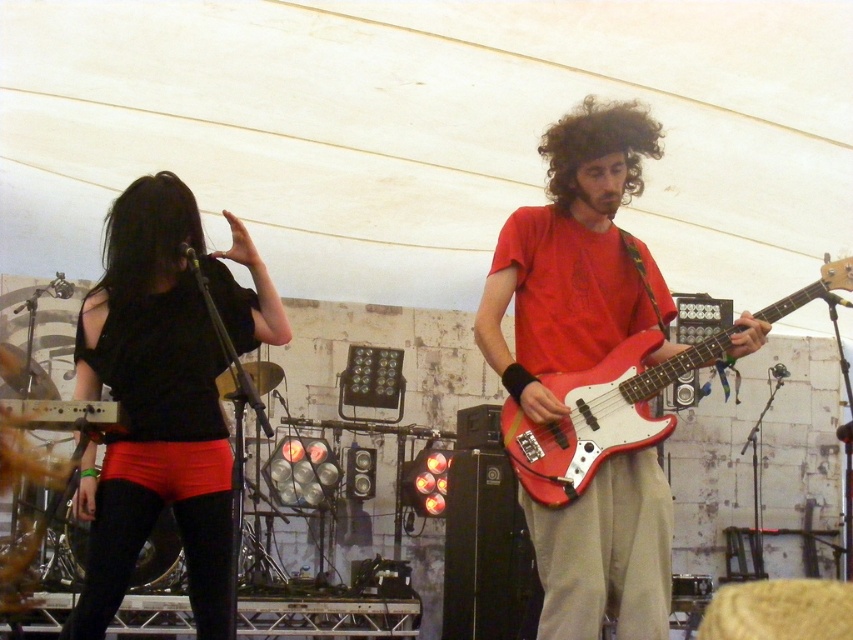
You are a photographer setting up for a live music shoot. You have a camera with a 30cm wide lens. You need to frame both the black matte shirt at left and the matte red electric guitar at right in your shot. Which object should you adjust your focus to first based on their widths?

The black matte shirt at left is thinner than the matte red electric guitar at right, so you should focus on the matte red electric guitar at right first since it is wider and requires more attention to capture its details properly.

You are a photographer trying to capture a clear shot of both the matte red guitar at center and the black matte shirt at left. Given their sizes, which object should you focus on first to ensure it fits in the frame?

The matte red guitar at center is much taller than the black matte shirt at left, so you should focus on capturing the matte red guitar at center first to ensure it fits in the frame.

You are a stagehand setting up equipment for a live performance. You need to place a tall amplifier that requires 1.2 meters of space. There is a space between the matte red guitar at center and the matte red electric guitar at right. Can the amplifier fit in that space?

The matte red guitar at center is taller than the matte red electric guitar at right, but the height difference does not indicate the space between them. The description does not provide information about the distance between the two guitars, so it is unknown if the amplifier can fit.